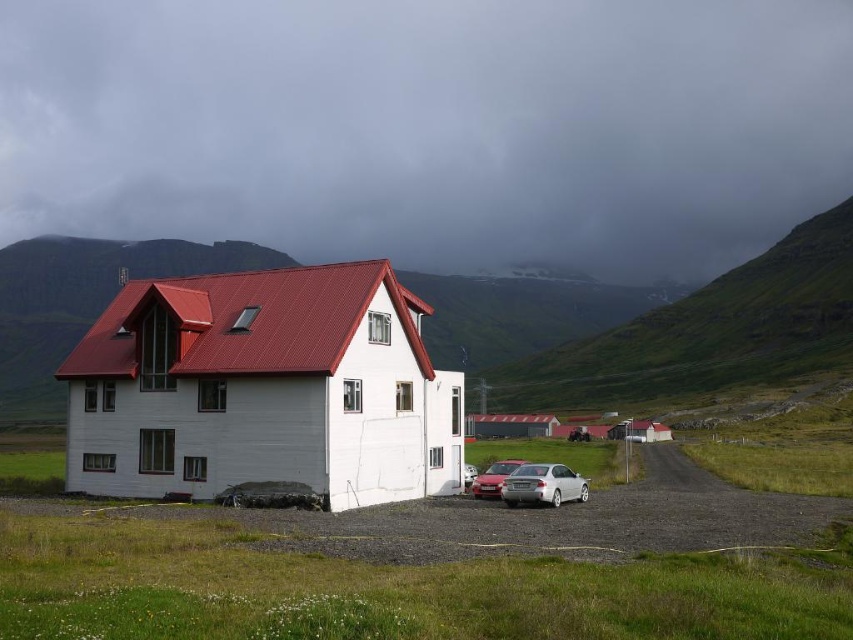
Is point (560, 392) positioned after point (497, 467)?

Yes, it is.

Is green grassy hillside at center smaller than satin silver sedan at lower center?

No.

What are the coordinates of `green grassy hillside at center` in the screenshot? It's located at (709, 332).

Is silver metallic car at lower center taller than satin silver sedan at lower center?

Yes.

Which is behind, point (561, 467) or point (486, 486)?

Positioned behind is point (486, 486).

Where is `silver metallic car at lower center`? silver metallic car at lower center is located at coordinates (543, 484).

Who is lower down, green grassy hillside at center or silver metallic car at lower center?

Positioned lower is silver metallic car at lower center.

Which is behind, point (677, 312) or point (583, 497)?

Point (677, 312)

Is point (773, 355) farther from viewer compared to point (566, 465)?

Yes, point (773, 355) is behind point (566, 465).

At what (x,y) coordinates should I click in order to perform the action: click on green grassy hillside at center. Please return your answer as a coordinate pair (x, y). This screenshot has width=853, height=640. Looking at the image, I should click on (709, 332).